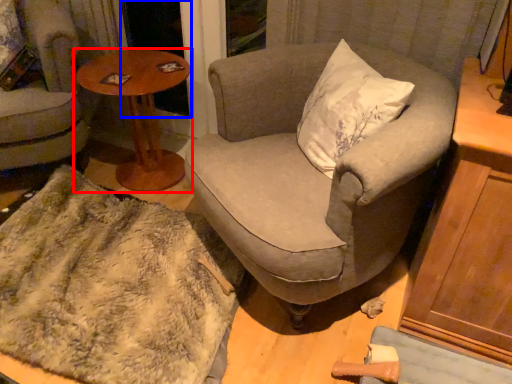
Question: Which point is further to the camera, table (highlighted by a red box) or screen door (highlighted by a blue box)?

Choices:
 (A) table
 (B) screen door

Answer: (B)